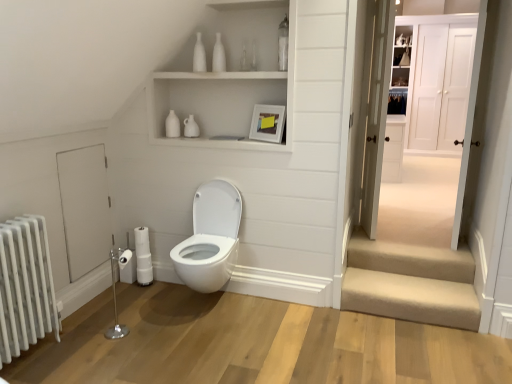
Identify the location of empty space that is to the right of white marble radiator at left. The image size is (512, 384). (77, 354).